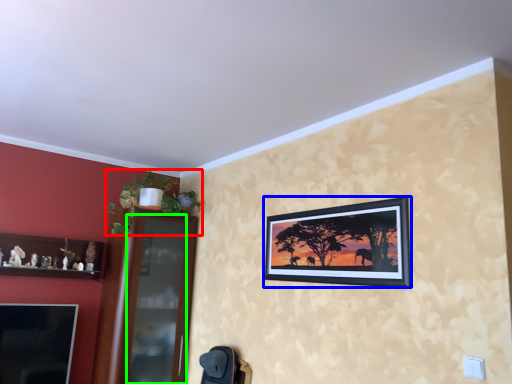
Question: Considering the real-world distances, which object is closest to plant (highlighted by a red box)? picture frame (highlighted by a blue box) or glass door (highlighted by a green box).

Choices:
 (A) picture frame
 (B) glass door

Answer: (B)